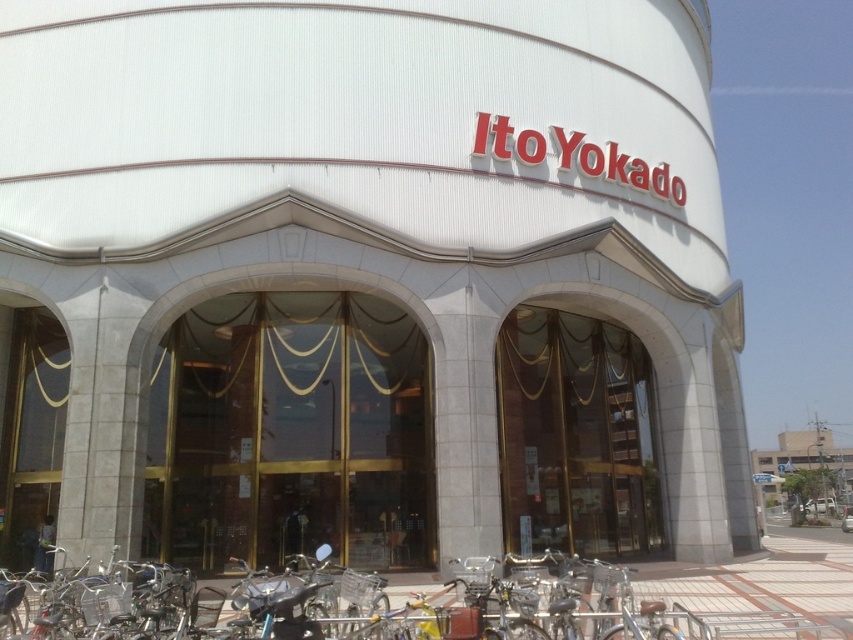
Is point (418, 600) positioned before point (811, 467)?

Yes.

Which is more to the right, silver metallic bicycle at lower center or white glass building at center?

white glass building at center is more to the right.

Which is behind, point (100, 632) or point (842, 456)?

Positioned behind is point (842, 456).

Where is `silver metallic bicycle at lower center`? The width and height of the screenshot is (853, 640). silver metallic bicycle at lower center is located at coordinates (408, 612).